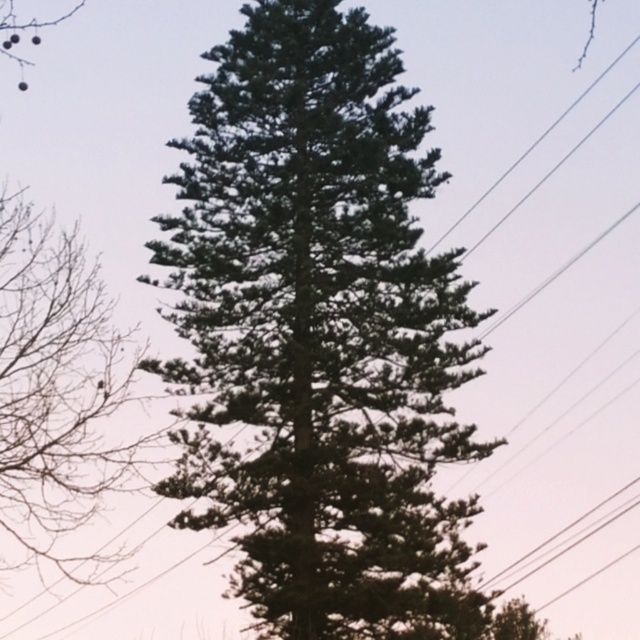
Question: Does green needle-like tree at center appear on the right side of clear wire at upper right?

Choices:
 (A) yes
 (B) no

Answer: (B)

Question: Which of the following is the closest to the observer?

Choices:
 (A) clear wire at upper right
 (B) green needle-like at center

Answer: (B)

Question: Is green needle-like tree at center smaller than green needle-like at center?

Choices:
 (A) yes
 (B) no

Answer: (A)

Question: Can you confirm if green needle-like tree at center is smaller than clear wire at upper right?

Choices:
 (A) yes
 (B) no

Answer: (B)

Question: Which point is farther from the camera taking this photo?

Choices:
 (A) (564, 109)
 (B) (93, 317)
 (C) (246, 596)

Answer: (A)

Question: Which point appears farthest from the camera in this image?

Choices:
 (A) (26, 442)
 (B) (540, 134)
 (C) (218, 477)

Answer: (B)